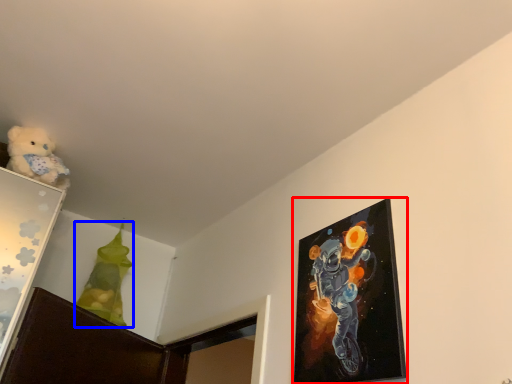
Question: Which of the following is the farthest to the observer, picture frame (highlighted by a red box) or toy (highlighted by a blue box)?

Choices:
 (A) picture frame
 (B) toy

Answer: (B)